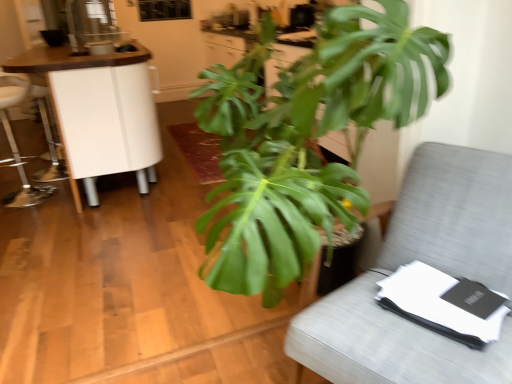
Question: Is white glossy cabinet at left wider than green leafy plant at center?

Choices:
 (A) no
 (B) yes

Answer: (B)

Question: Is white glossy cabinet at left facing away from green leafy plant at center?

Choices:
 (A) no
 (B) yes

Answer: (A)

Question: From the image's perspective, is white glossy cabinet at left under green leafy plant at center?

Choices:
 (A) yes
 (B) no

Answer: (B)

Question: Is white glossy cabinet at left not within green leafy plant at center?

Choices:
 (A) yes
 (B) no

Answer: (A)

Question: From a real-world perspective, is white glossy cabinet at left over green leafy plant at center?

Choices:
 (A) yes
 (B) no

Answer: (B)

Question: Is white glossy cabinet at left in contact with green leafy plant at center?

Choices:
 (A) yes
 (B) no

Answer: (B)

Question: Is green leafy plant at center looking in the opposite direction of white glossy cabinet at left?

Choices:
 (A) yes
 (B) no

Answer: (B)

Question: Is green leafy plant at center facing towards white glossy cabinet at left?

Choices:
 (A) no
 (B) yes

Answer: (A)

Question: From a real-world perspective, is green leafy plant at center located higher than white glossy cabinet at left?

Choices:
 (A) no
 (B) yes

Answer: (B)

Question: Can you confirm if green leafy plant at center is thinner than white glossy cabinet at left?

Choices:
 (A) no
 (B) yes

Answer: (B)

Question: From the image's perspective, would you say green leafy plant at center is positioned over white glossy cabinet at left?

Choices:
 (A) yes
 (B) no

Answer: (B)

Question: From the image's perspective, is green leafy plant at center located beneath white glossy cabinet at left?

Choices:
 (A) no
 (B) yes

Answer: (B)

Question: Can you confirm if gray fabric chair at right is bigger than metallic silver swivel chair at left?

Choices:
 (A) yes
 (B) no

Answer: (A)